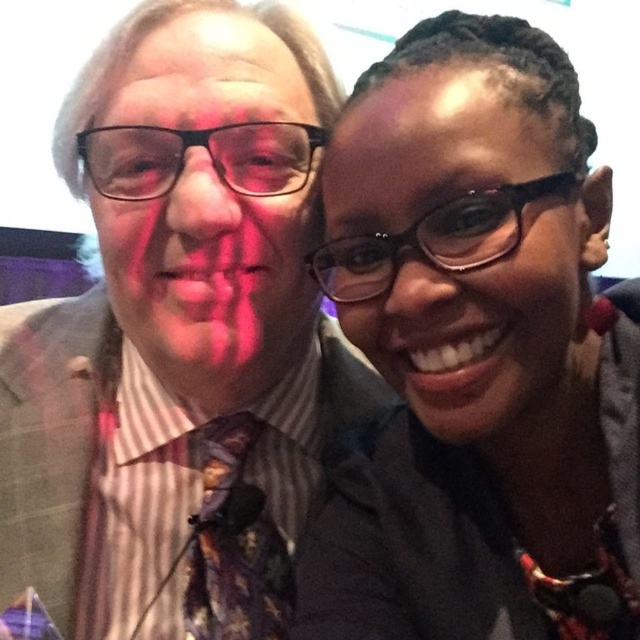
Question: Which of the following is the closest to the observer?

Choices:
 (A) matte black glasses at upper right
 (B) striped fabric shirt at center

Answer: (A)

Question: Is matte black glasses at upper right thinner than floral silk tie at center?

Choices:
 (A) yes
 (B) no

Answer: (B)

Question: Is striped fabric shirt at center wider than matte black glasses at upper right?

Choices:
 (A) yes
 (B) no

Answer: (A)

Question: Which object is positioned farthest from the matte black glasses at upper right?

Choices:
 (A) floral silk tie at center
 (B) striped fabric shirt at center

Answer: (A)

Question: Is matte black glasses at upper right bigger than floral silk tie at center?

Choices:
 (A) yes
 (B) no

Answer: (A)

Question: Based on their relative distances, which object is nearer to the matte black glasses at upper right?

Choices:
 (A) striped fabric shirt at center
 (B) floral silk tie at center

Answer: (A)